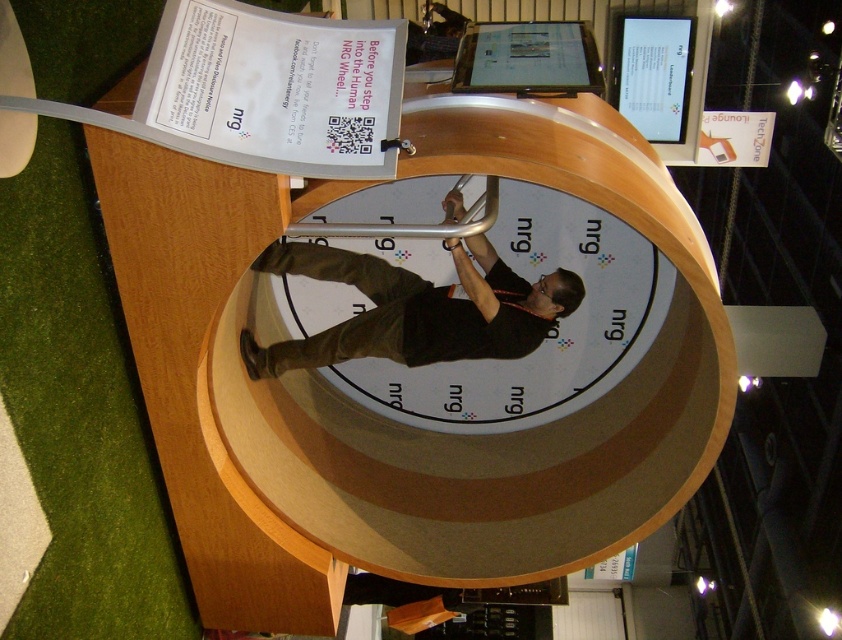
From the picture: You are a photographer at the event and need to position yourself so that both the dark brown leather pants at center and the matte black monitor at upper center are visible in your shot. Which side of the monitor should you stand to capture both objects in the frame?

You should stand to the left side of the matte black monitor at upper center to capture both the dark brown leather pants at center and the matte black monitor at upper center in the frame since the dark brown leather pants at center is positioned to the left of the matte black monitor at upper center.

You are standing in front of the NRG Wheel and want to reach a point marked at coordinates point (x=361, y=323). If you can move forward 3 meters, will you be able to reach that point?

The distance of point (x=361, y=323) from viewer is 3.83 meters. Since you can move forward only 3 meters, you will not be able to reach the point as it is farther away than your movement capability.